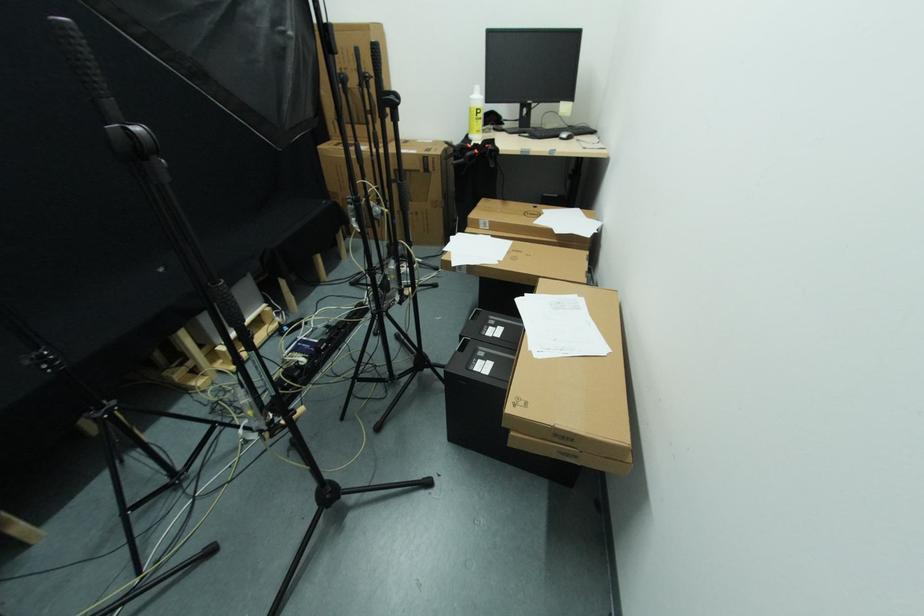
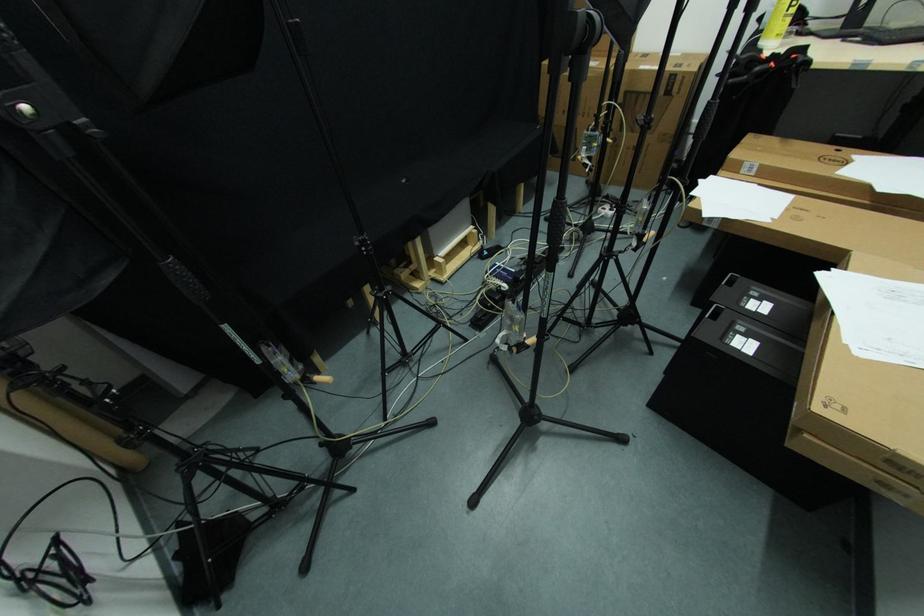
Where in the second image is the point corresponding to pixel 487 361 from the first image?

(748, 339)